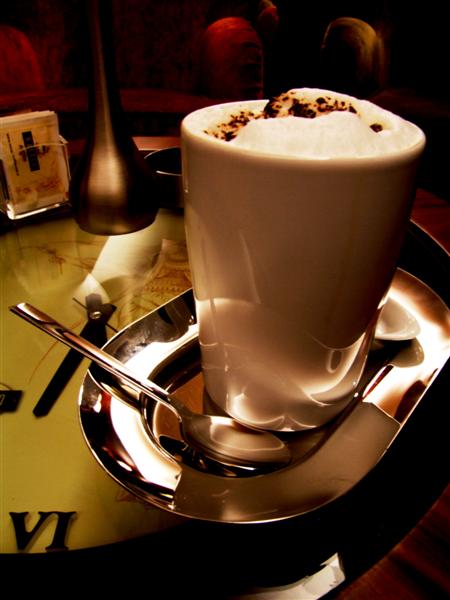
At what (x,y) coordinates should I click in order to perform the action: click on wooden tabletop. Please return your answer as a coordinate pair (x, y). The width and height of the screenshot is (450, 600). Looking at the image, I should click on tap(433, 564).